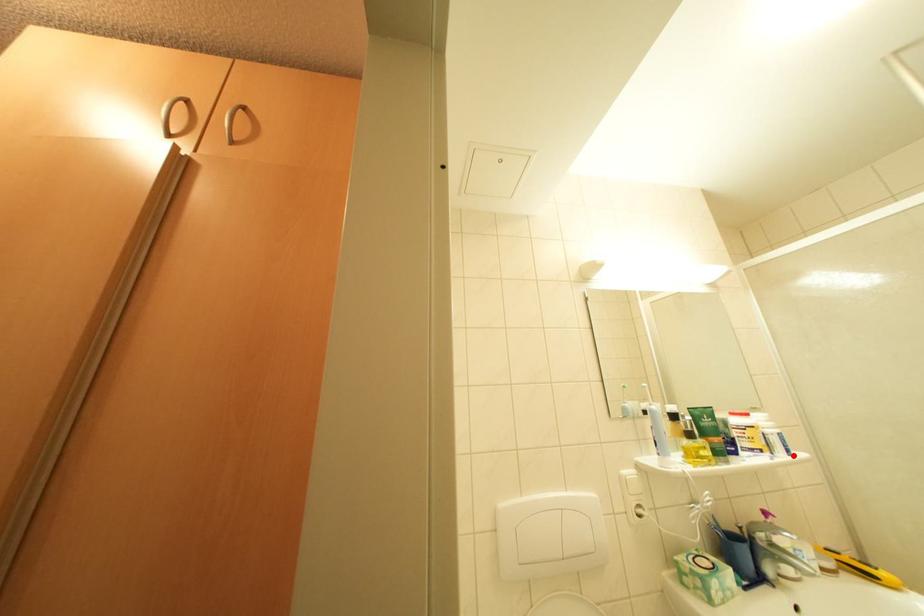
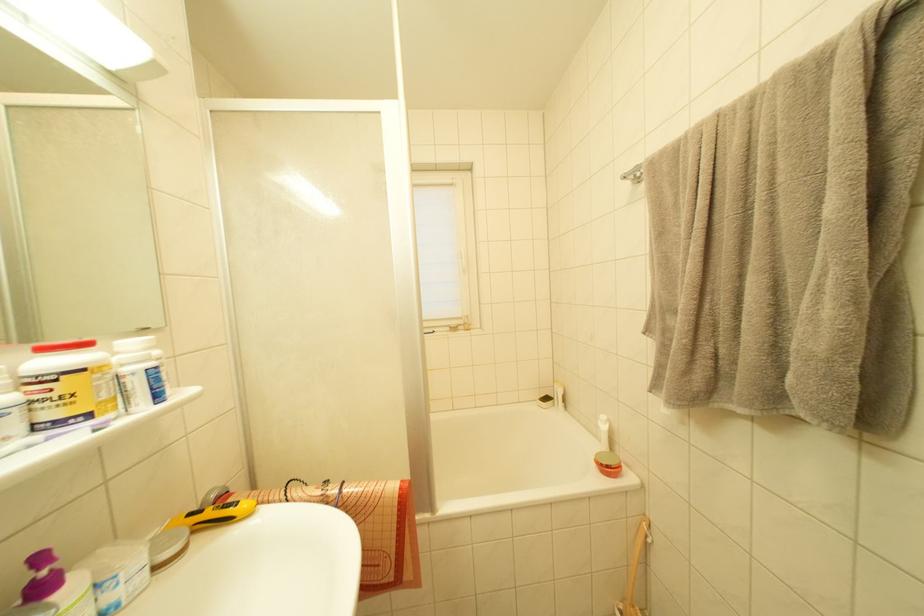
Find the pixel in the second image that matches the highlighted location in the first image.

(163, 400)